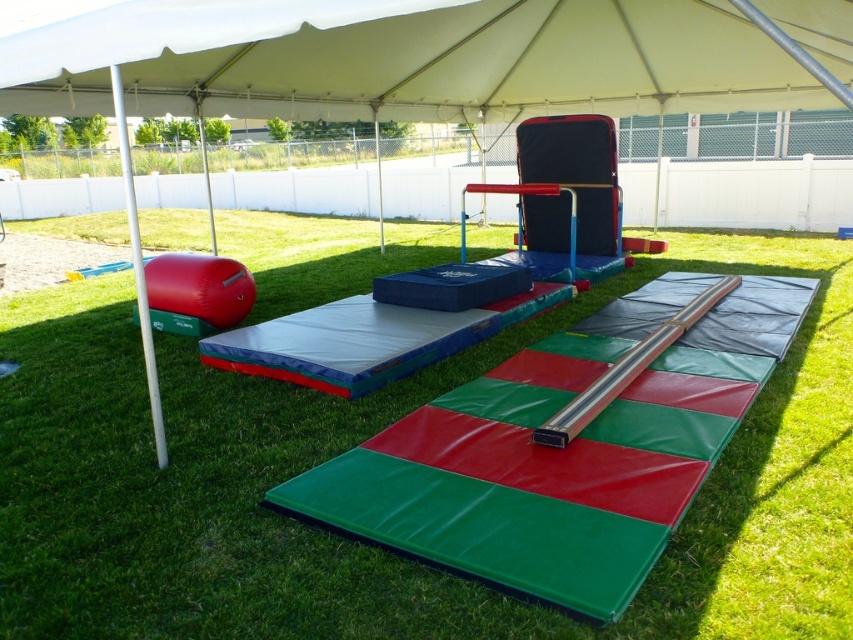
Question: Which of the following is the closest to the observer?

Choices:
 (A) white smooth pole at left
 (B) white fabric tent at center
 (C) white fabric canopy at upper center
 (D) green soft grass at center

Answer: (D)

Question: Can you confirm if green soft grass at center is bigger than white smooth pole at left?

Choices:
 (A) no
 (B) yes

Answer: (A)

Question: Can you confirm if white fabric tent at center is bigger than white fabric canopy at upper center?

Choices:
 (A) no
 (B) yes

Answer: (B)

Question: Estimate the real-world distances between objects in this image. Which object is farther from the white fabric canopy at upper center?

Choices:
 (A) green soft grass at center
 (B) white fabric tent at center
 (C) white smooth pole at left

Answer: (C)

Question: Which object is closer to the camera taking this photo?

Choices:
 (A) white fabric tent at center
 (B) white fabric canopy at upper center

Answer: (A)

Question: Is green soft grass at center below white fabric canopy at upper center?

Choices:
 (A) no
 (B) yes

Answer: (B)